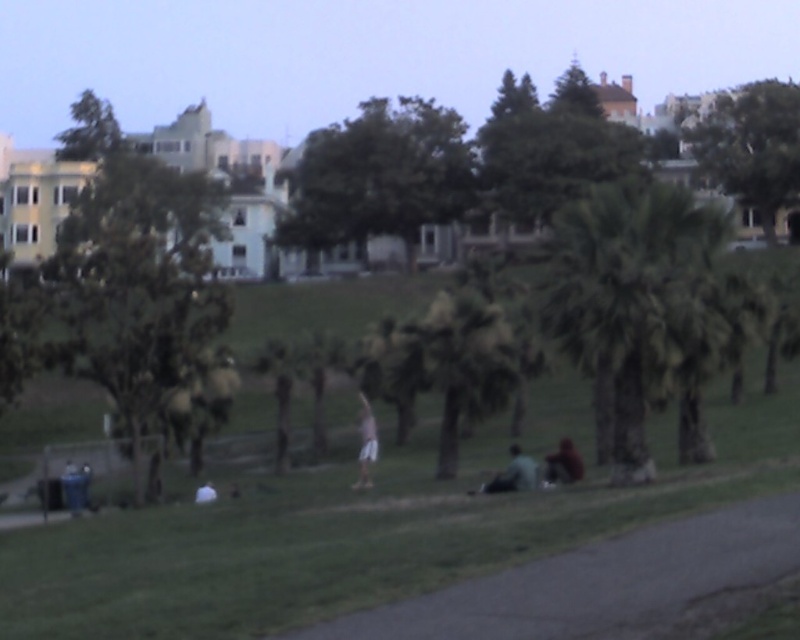
Question: Which object is closer to the camera taking this photo?

Choices:
 (A) dark green fabric at lower center
 (B) white cotton shorts at center
 (C) green leafy tree at center

Answer: (A)

Question: Is green leafy tree at left positioned behind green leafy palm tree at center?

Choices:
 (A) yes
 (B) no

Answer: (A)

Question: Considering the relative positions of green leafy palm tree at center and white cotton shirt at center in the image provided, where is green leafy palm tree at center located with respect to white cotton shirt at center?

Choices:
 (A) right
 (B) left

Answer: (A)

Question: Can you confirm if green leafy tree at upper right is smaller than white cotton shorts at center?

Choices:
 (A) no
 (B) yes

Answer: (A)

Question: Among these points, which one is farthest from the camera?

Choices:
 (A) (196, 500)
 (B) (576, 477)
 (C) (624, 248)

Answer: (A)

Question: Which point is closer to the camera?

Choices:
 (A) (336, 156)
 (B) (614, 362)

Answer: (B)